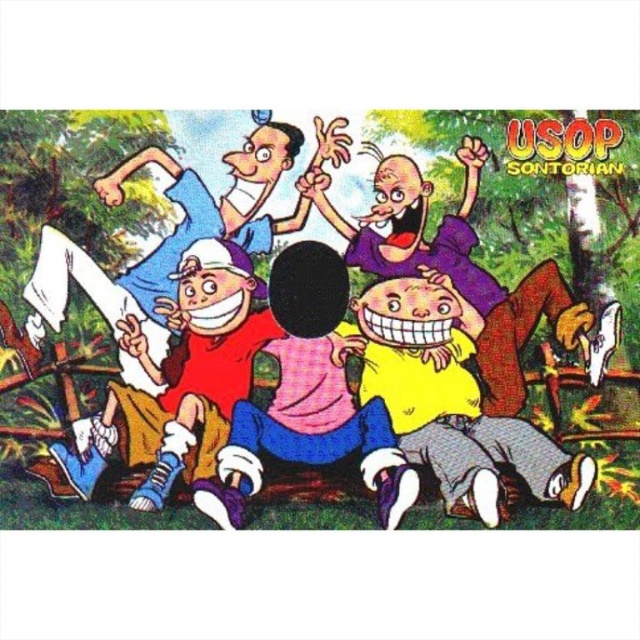
Looking at this image, is yellow matte shirt at center taller than smooth purple shirt at center?

No, yellow matte shirt at center is not taller than smooth purple shirt at center.

The width and height of the screenshot is (640, 640). Describe the element at coordinates (458, 400) in the screenshot. I see `yellow matte shirt at center` at that location.

Identify the location of yellow matte shirt at center. (458, 400).

Between smooth plastic head at center and matte red shirt at center, which one is positioned higher?

smooth plastic head at center is above.

Between smooth plastic head at center and matte red shirt at center, which one has less height?

With less height is matte red shirt at center.

At what (x,y) coordinates should I click in order to perform the action: click on smooth plastic head at center. Please return your answer as a coordinate pair (x, y). This screenshot has width=640, height=640. Looking at the image, I should click on (317, 310).

Which is more to the right, smooth plastic head at center or matte pink shirt at center?

Positioned to the right is matte pink shirt at center.

Between smooth plastic head at center and matte pink shirt at center, which one is positioned higher?

Positioned higher is smooth plastic head at center.

Is point (193, 401) behind point (241, 474)?

Yes, it is behind point (241, 474).

Identify the location of smooth plastic head at center. (317, 310).